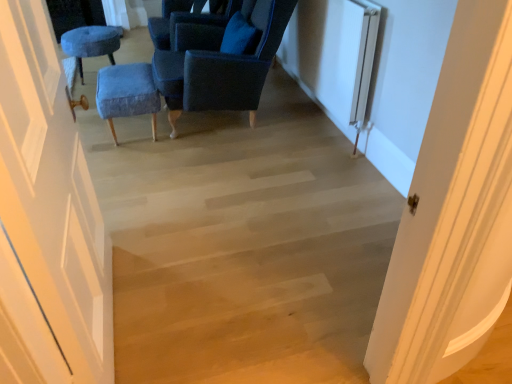
Identify the location of vacant space in front of white textured radiator at right. (297, 184).